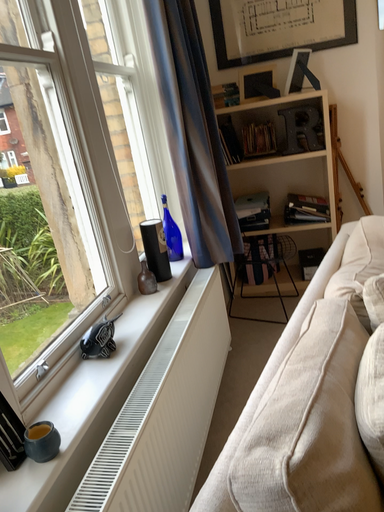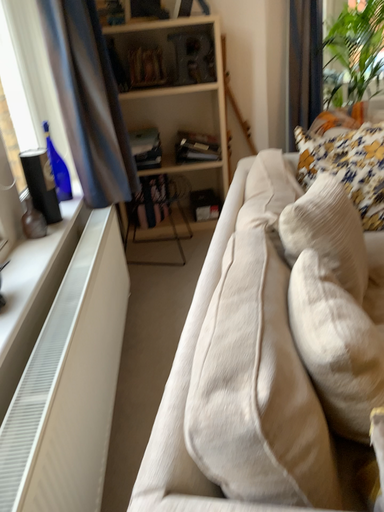
Question: How did the camera likely rotate when shooting the video?

Choices:
 (A) rotated right
 (B) rotated left

Answer: (A)